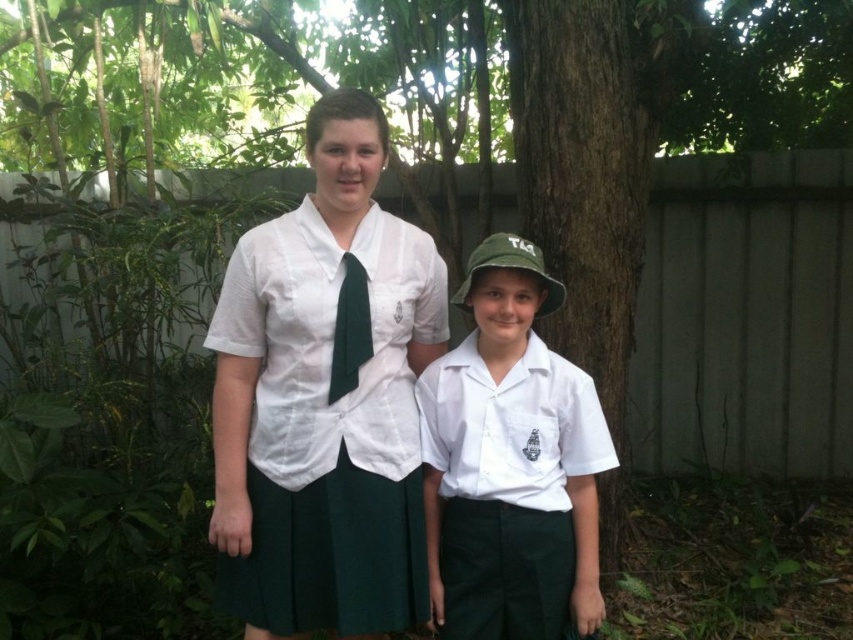
Does matte white blouse at center lie behind white fabric shirt at center?

No, it is in front of white fabric shirt at center.

Between matte white blouse at center and white fabric shirt at center, which one is positioned lower?

white fabric shirt at center

Between point (350, 289) and point (573, 388), which one is positioned behind?

Positioned behind is point (573, 388).

Find the location of a particular element. matte white blouse at center is located at coordinates (325, 397).

Is matte white blouse at center smaller than green silk tie at center?

Actually, matte white blouse at center might be larger than green silk tie at center.

Is matte white blouse at center thinner than green silk tie at center?

No, matte white blouse at center is not thinner than green silk tie at center.

Describe the element at coordinates (325, 397) in the screenshot. I see `matte white blouse at center` at that location.

This screenshot has height=640, width=853. What are the coordinates of `matte white blouse at center` in the screenshot? It's located at (325, 397).

Is white fabric shirt at center closer to the viewer compared to green silk tie at center?

That is True.

Which of these two, white fabric shirt at center or green silk tie at center, stands shorter?

With less height is green silk tie at center.

Describe the element at coordinates (509, 464) in the screenshot. This screenshot has height=640, width=853. I see `white fabric shirt at center` at that location.

Find the location of a particular element. The image size is (853, 640). white fabric shirt at center is located at coordinates (509, 464).